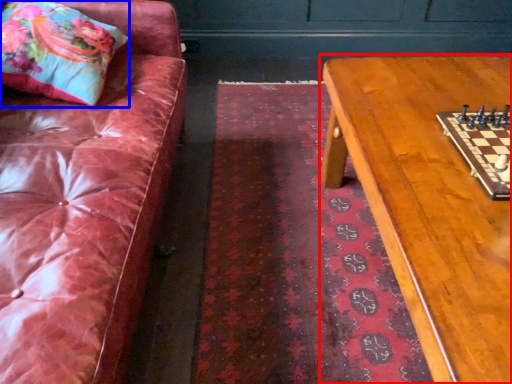
Question: Which object appears closest to the camera in this image, table (highlighted by a red box) or throw pillow (highlighted by a blue box)?

Choices:
 (A) table
 (B) throw pillow

Answer: (A)